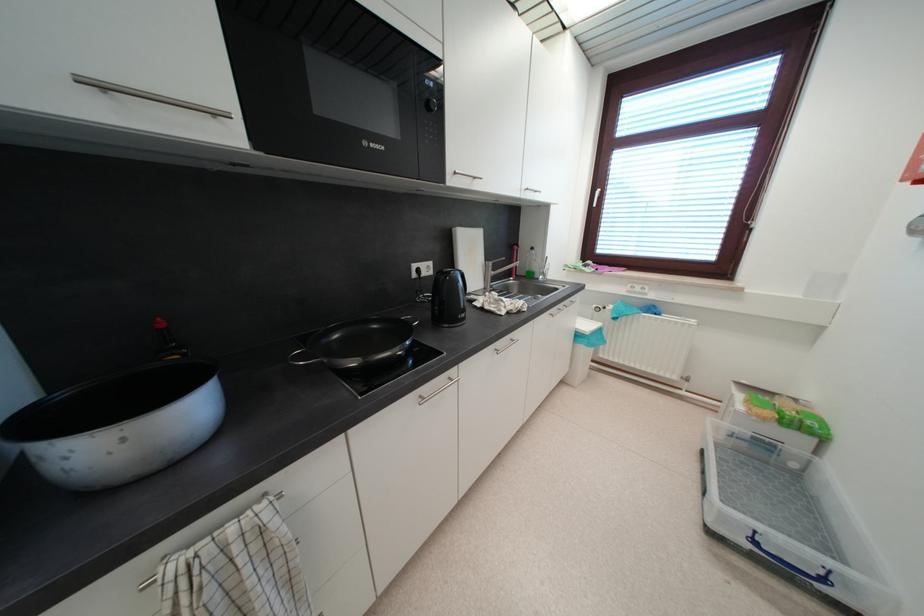
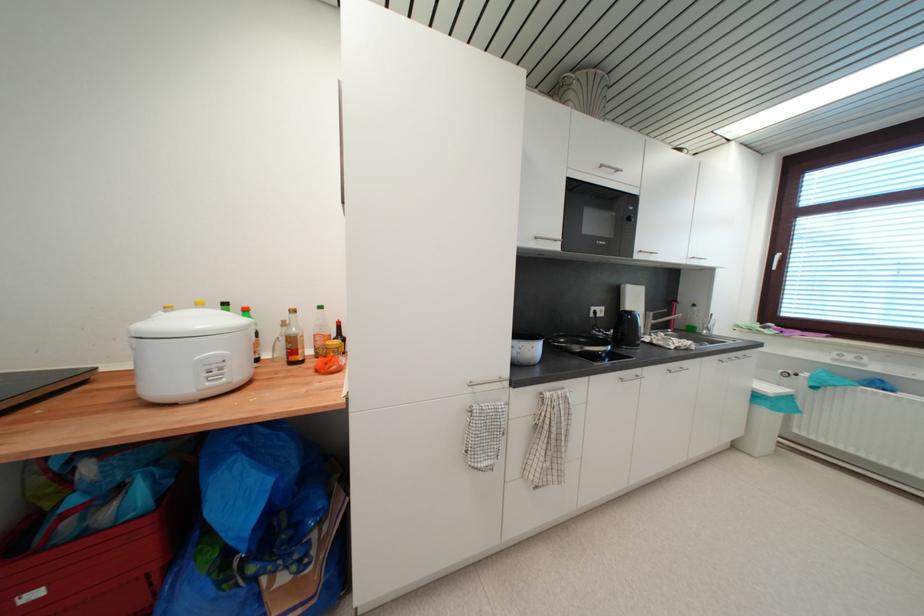
Question: How did the camera likely rotate?

Choices:
 (A) Left
 (B) Right
 (C) Up
 (D) Down

Answer: (A)